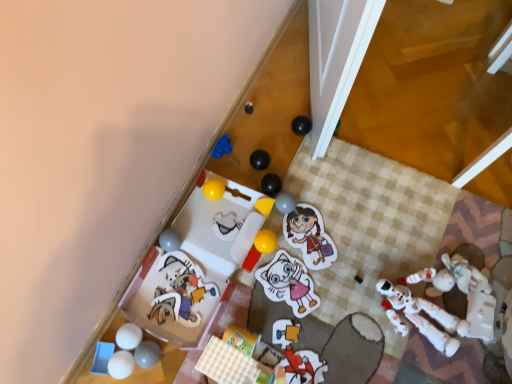
At what (x,y) coordinates should I click in order to perform the action: click on unoccupied space behind matte gray ball at lower left, which is counted as the twelfth toy, starting from the right. Please return your answer as a coordinate pair (x, y). Image resolution: width=512 pixels, height=384 pixels. Looking at the image, I should click on tap(169, 301).